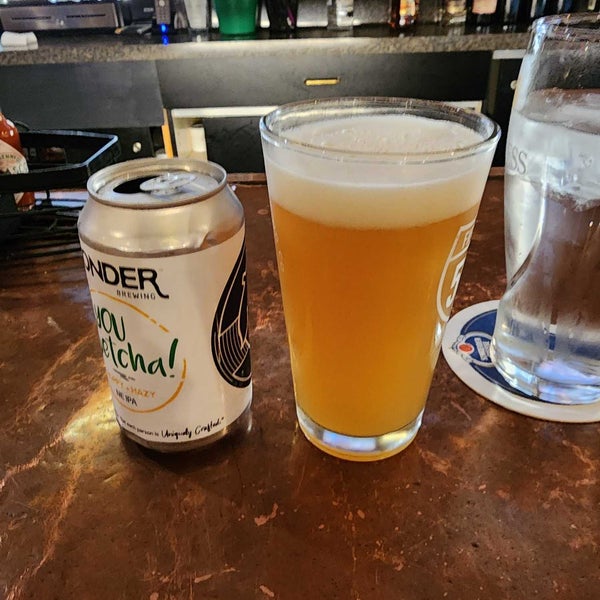
Where is `coaster`? This screenshot has height=600, width=600. coaster is located at coordinates (477, 342).